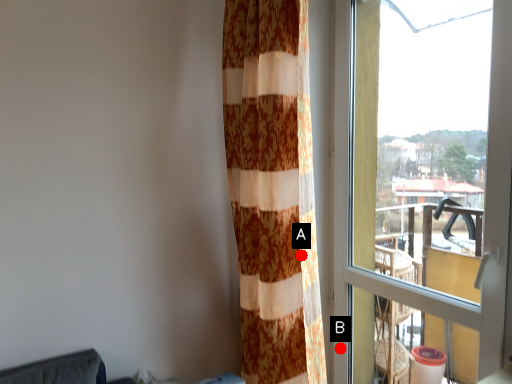
Question: Two points are circled on the image, labeled by A and B beside each circle. Which point is farther to the camera?

Choices:
 (A) A is further
 (B) B is further

Answer: (B)